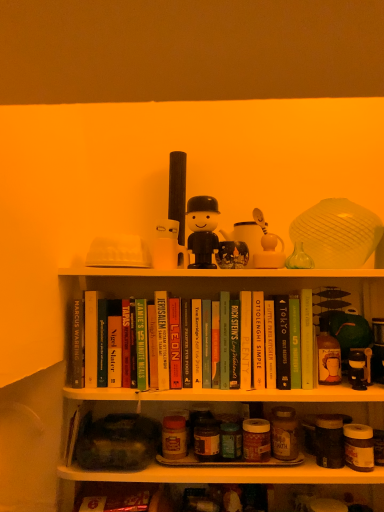
Identify the location of hardcover book at center, the eleventh paperback book in the left-to-right sequence. This screenshot has width=384, height=512. (270, 344).

Locate an element on the screen. smooth plastic toy at center, the 1th toy when ordered from left to right is located at coordinates pos(168,247).

The width and height of the screenshot is (384, 512). Describe the element at coordinates (78, 344) in the screenshot. I see `hardcover book at center, positioned as the first paperback book in left-to-right order` at that location.

Describe the element at coordinates (224, 340) in the screenshot. I see `hardcover book at center, the seventh paperback book in the right-to-left sequence` at that location.

Where is `hardcover book at center, which ranks as the 6th paperback book in left-to-right order`? hardcover book at center, which ranks as the 6th paperback book in left-to-right order is located at coordinates (175, 343).

From the image's perspective, which one is positioned higher, hardcover book at center, which appears as the 14th paperback book when viewed from the right, or white glossy spoon at upper center, the 4th toy viewed from the left?

From the image's view, white glossy spoon at upper center, the 4th toy viewed from the left, is above.

Considering the sizes of objects hardcover book at center, which appears as the 14th paperback book when viewed from the right, and white glossy spoon at upper center, the 4th toy viewed from the left, in the image provided, who is taller, hardcover book at center, which appears as the 14th paperback book when viewed from the right, or white glossy spoon at upper center, the 4th toy viewed from the left,?

Standing taller between the two is hardcover book at center, which appears as the 14th paperback book when viewed from the right.

Between hardcover book at center, positioned as the first paperback book in left-to-right order, and white glossy spoon at upper center, the first toy from the right, which one has smaller width?

white glossy spoon at upper center, the first toy from the right, is thinner.

Are hardcover book at center, arranged as the 5th paperback book when viewed from the right, and hardcover book at center, which is counted as the fourth paperback book, starting from the left, located far from each other?

They are positioned close to each other.

In the image, is hardcover book at center, arranged as the 5th paperback book when viewed from the right, on the left side or the right side of hardcover book at center, which is the eleventh paperback book in right-to-left order?

Clearly, hardcover book at center, arranged as the 5th paperback book when viewed from the right, is on the right of hardcover book at center, which is the eleventh paperback book in right-to-left order, in the image.

From a real-world perspective, is hardcover book at center, which is counted as the 10th paperback book, starting from the left, located higher than hardcover book at center, which is counted as the fourth paperback book, starting from the left?

Yes, from a real-world perspective, hardcover book at center, which is counted as the 10th paperback book, starting from the left, is above hardcover book at center, which is counted as the fourth paperback book, starting from the left.

Between point (297, 349) and point (227, 469), which one is positioned behind?

Point (297, 349)

From the picture: From the image's perspective, is hardcover book at center, the 13th paperback book positioned from the left, located beneath matte glass jars at lower center?

No.

From a real-world perspective, is hardcover book at center, the 13th paperback book positioned from the left, on matte glass jars at lower center?

Yes, from a real-world perspective, hardcover book at center, the 13th paperback book positioned from the left, is over matte glass jars at lower center

Which is in front, hardcover book at center, the 13th paperback book positioned from the left, or matte glass jars at lower center?

matte glass jars at lower center is more forward.

The image size is (384, 512). I want to click on paperback book that is the 6th object located below the white glossy spoon at upper center, the 4th toy viewed from the left (from the image's perspective), so click(x=282, y=342).

Does white glossy spoon at upper center, the 4th toy viewed from the left, come behind hardcover book at center, which appears as the 3th paperback book when viewed from the right?

Yes, it is.

Does white glossy spoon at upper center, the 4th toy viewed from the left, have a lesser width compared to hardcover book at center, placed as the 12th paperback book when sorted from left to right?

Yes.

In order to click on the 1st toy counting from the right of the hardcover book at center, which is the second paperback book from left to right in this screenshot , I will do `click(168, 247)`.

Looking at this image, is hardcover book at center, which is the second paperback book from left to right, far from smooth plastic toy at center, the 1th toy when ordered from left to right?

Actually, hardcover book at center, which is the second paperback book from left to right, and smooth plastic toy at center, the 1th toy when ordered from left to right, are a little close together.

Could you tell me if hardcover book at center, which is the second paperback book from left to right, is turned towards smooth plastic toy at center, the 1th toy when ordered from left to right?

No.

Is hardcover book at center, the eleventh paperback book in the left-to-right sequence, inside hardcover book at center, the seventh paperback book in the right-to-left sequence?

No.

From a real-world perspective, is hardcover book at center, which is the eighth paperback book in left-to-right order, physically above hardcover book at center, which ranks as the fourth paperback book in right-to-left order?

Indeed, from a real-world perspective, hardcover book at center, which is the eighth paperback book in left-to-right order, stands above hardcover book at center, which ranks as the fourth paperback book in right-to-left order.

Which of these two, hardcover book at center, which is the eighth paperback book in left-to-right order, or hardcover book at center, the eleventh paperback book in the left-to-right sequence, is wider?

hardcover book at center, which is the eighth paperback book in left-to-right order, is wider.

You are a GUI agent. You are given a task and a screenshot of the screen. Output one action in this format:
    pyautogui.click(x=<x>, y=<y>)
    Task: Click on the 3rd paperback book below the smooth plastic toy at center, the 1th toy when ordered from left to right (from the image's perspective)
    
    Given the screenshot: What is the action you would take?
    pyautogui.click(x=162, y=339)

From a real-world perspective, is hardcover book at center, which ranks as the tenth paperback book in right-to-left order, physically located above or below smooth plastic toy at center, the 1th toy when ordered from left to right?

From a real-world perspective, hardcover book at center, which ranks as the tenth paperback book in right-to-left order, is physically below smooth plastic toy at center, the 1th toy when ordered from left to right.

Is hardcover book at center, the 5th paperback book viewed from the left, completely or partially outside of smooth plastic toy at center, which is the 4th toy in right-to-left order?

Yes.

Which object is positioned more to the right, hardcover book at center, the 5th paperback book viewed from the left, or smooth plastic toy at center, the 1th toy when ordered from left to right?

smooth plastic toy at center, the 1th toy when ordered from left to right.

You are a GUI agent. You are given a task and a screenshot of the screen. Output one action in this format:
    pyautogui.click(x=<x>, y=<y>)
    Task: Click on the 10th paperback book to the left of the white glossy spoon at upper center, the 4th toy viewed from the left, counting from the anchor's position
    The width and height of the screenshot is (384, 512).
    Given the screenshot: What is the action you would take?
    pyautogui.click(x=78, y=344)

The width and height of the screenshot is (384, 512). Identify the location of the 9th paperback book behind the hardcover book at center, arranged as the 5th paperback book when viewed from the right, counting from the anchor's position. (152, 346).

Estimate the real-world distances between objects in this image. Which object is further from hardcover book at center, which appears as the 14th paperback book when viewed from the right, hardcover book at center, which is counted as the fourth paperback book, starting from the left, or hardcover book at center, the seventh paperback book in the right-to-left sequence?

The object further to hardcover book at center, which appears as the 14th paperback book when viewed from the right, is hardcover book at center, the seventh paperback book in the right-to-left sequence.

When comparing their distances from hardcover green book at center, acting as the sixth paperback book starting from the right, does hardcover book at center, marked as the 3th paperback book in a left-to-right arrangement, or hardcover book at center, the ninth paperback book when ordered from right to left, seem further?

hardcover book at center, marked as the 3th paperback book in a left-to-right arrangement.

Which object lies further to the anchor point hardcover book at center, which ranks as the tenth paperback book in right-to-left order, hardcover book at center, which is counted as the 10th paperback book, starting from the left, or matte glass jars at lower center?

Among the two, matte glass jars at lower center is located further to hardcover book at center, which ranks as the tenth paperback book in right-to-left order.

Looking at the image, which one is located further to hardcover book at center, the second paperback book in the right-to-left sequence, hardcover book at center, which is the eleventh paperback book in right-to-left order, or smooth plastic toy at center, the 1th toy when ordered from left to right?

Based on the image, hardcover book at center, which is the eleventh paperback book in right-to-left order, appears to be further to hardcover book at center, the second paperback book in the right-to-left sequence.

When comparing their distances from white glossy spoon at upper center, the 4th toy viewed from the left, does matte black figurine at upper center, the 2th toy from the right, or hardcover book at center, which appears as the 3th paperback book when viewed from the right, seem further?

hardcover book at center, which appears as the 3th paperback book when viewed from the right.

Based on their spatial positions, is hardcover book at center, marked as the 3th paperback book in a left-to-right arrangement, or black matte figure at center, acting as the second toy starting from the left, further from green matte book at center, positioned as the 14th paperback book in left-to-right order?

hardcover book at center, marked as the 3th paperback book in a left-to-right arrangement, is further to green matte book at center, positioned as the 14th paperback book in left-to-right order.

From the image, which object appears to be farther from hardcover book at center, the ninth paperback book when ordered from right to left, hardcover book at center, the eleventh paperback book in the left-to-right sequence, or hardcover book at center, the seventh paperback book in the right-to-left sequence?

Based on the image, hardcover book at center, the eleventh paperback book in the left-to-right sequence, appears to be further to hardcover book at center, the ninth paperback book when ordered from right to left.

When comparing their distances from smooth plastic toy at center, the 1th toy when ordered from left to right, does hardcover book at center, which is counted as the fourth paperback book, starting from the left, or hardcover book at center, the second paperback book in the right-to-left sequence, seem further?

hardcover book at center, the second paperback book in the right-to-left sequence, is further to smooth plastic toy at center, the 1th toy when ordered from left to right.

Where is `shelf between hardcover book at center, positioned as the first paperback book in left-to-right order, and hardcover book at center, the 13th paperback book positioned from the left, from left to right`? shelf between hardcover book at center, positioned as the first paperback book in left-to-right order, and hardcover book at center, the 13th paperback book positioned from the left, from left to right is located at coordinates (231, 474).

Find the location of `toy located between hardcover book at center, which appears as the 14th paperback book when viewed from the right, and hardcover book at center, which is counted as the 8th paperback book, starting from the right, in the left-right direction`. toy located between hardcover book at center, which appears as the 14th paperback book when viewed from the right, and hardcover book at center, which is counted as the 8th paperback book, starting from the right, in the left-right direction is located at coordinates (168, 247).

At what (x,y) coordinates should I click in order to perform the action: click on shelf situated between hardcover book at center, placed as the 13th paperback book when sorted from right to left, and hardcover book at center, the eleventh paperback book in the left-to-right sequence, from left to right. Please return your answer as a coordinate pair (x, y). Looking at the image, I should click on (231, 474).

At what (x,y) coordinates should I click in order to perform the action: click on paperback book located between hardcover book at center, which ranks as the tenth paperback book in right-to-left order, and hardcover book at center, which is the 7th paperback book from left to right, in the left-right direction. Please return your answer as a coordinate pair (x, y). Image resolution: width=384 pixels, height=512 pixels. Looking at the image, I should click on (175, 343).